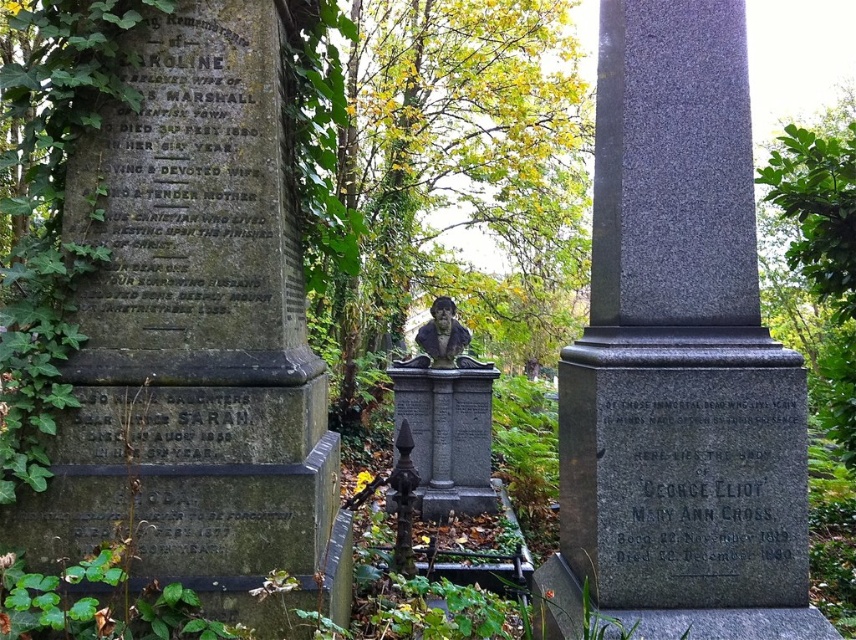
I want to click on granite obelisk at center, so click(678, 337).

Does granite obelisk at center have a larger size compared to polished bronze bust at center?

Indeed, granite obelisk at center has a larger size compared to polished bronze bust at center.

Image resolution: width=856 pixels, height=640 pixels. What do you see at coordinates (678, 337) in the screenshot?
I see `granite obelisk at center` at bounding box center [678, 337].

I want to click on granite obelisk at center, so click(678, 337).

Find the location of `granite stone monument at left`. granite stone monument at left is located at coordinates (197, 339).

Is granite stone monument at left smaller than granite obelisk at center?

No, granite stone monument at left is not smaller than granite obelisk at center.

This screenshot has height=640, width=856. I want to click on granite stone monument at left, so click(197, 339).

Who is more distant from viewer, (397, 500) or (438, 300)?

Positioned behind is point (438, 300).

Is point (428, 364) farther from viewer compared to point (443, 316)?

Yes, it is.

Is point (467, 513) behind point (428, 333)?

No, (467, 513) is closer to viewer.

Find the location of `polished bronze bust at center`. polished bronze bust at center is located at coordinates (446, 417).